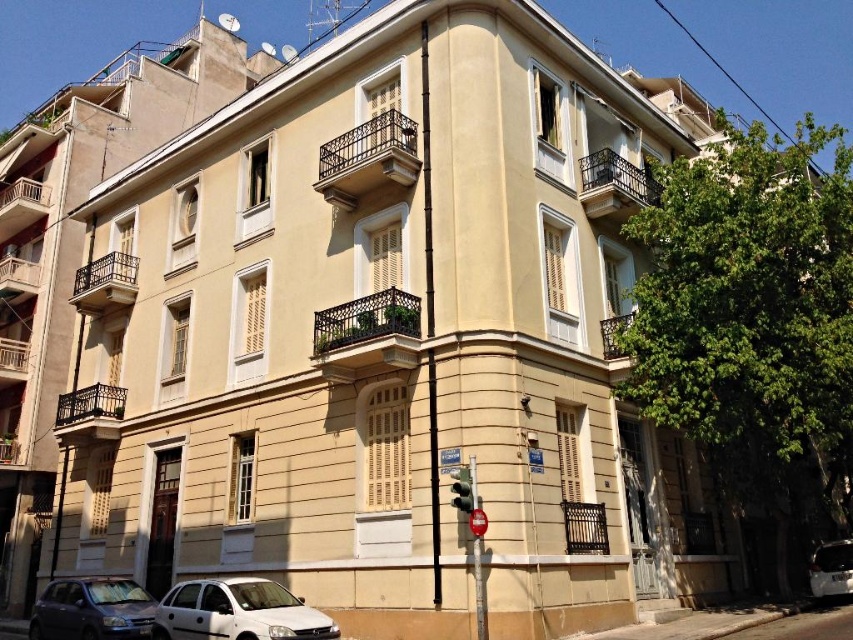
You are a pedestrian standing at the sidewalk near the green glass traffic light at lower center. You want to cross the street to reach the beige residential building. Is the white glossy car at lower right blocking your path?

The white glossy car at lower right is below green glass traffic light at lower center, so it is positioned closer to the sidewalk. This means the white glossy car at lower right is blocking your path to cross the street.

You are standing at the street corner in front of the residential building and see the white matte car at lower center and the green glass traffic light at lower center. Which object is nearer to you?

The white matte car at lower center is closer to the viewer than the green glass traffic light at lower center.